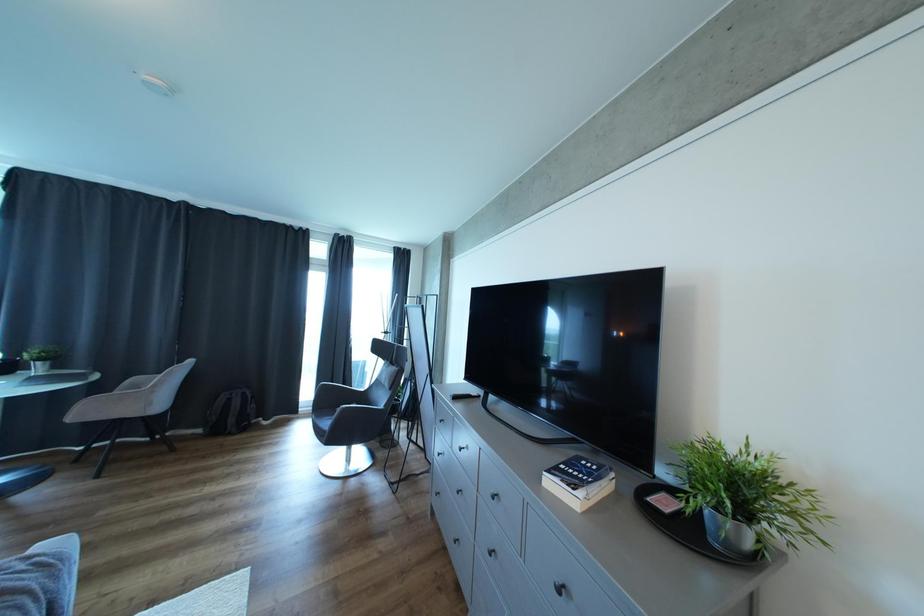
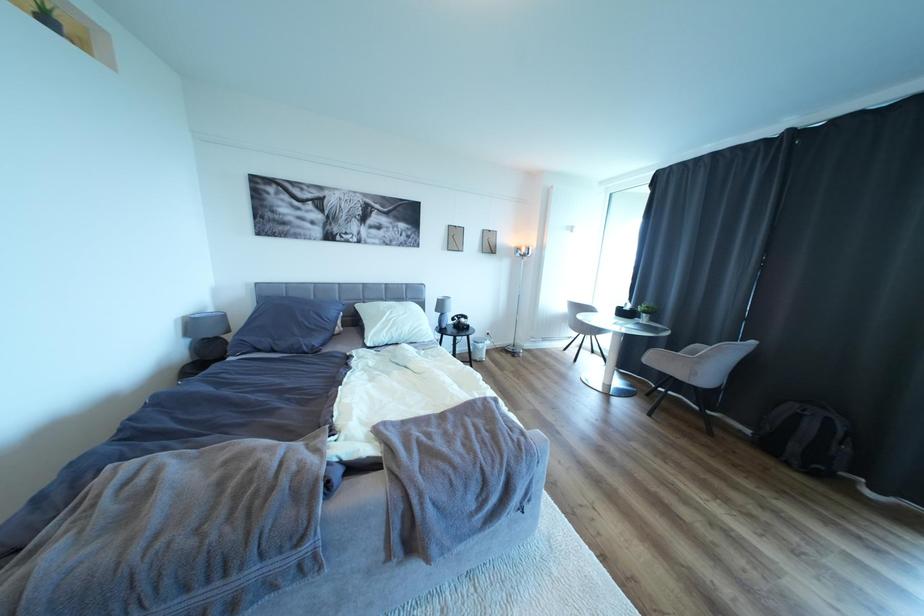
Question: The camera is either moving clockwise (left) or counter-clockwise (right) around the object. The first image is from the beginning of the video and the second image is from the end. Is the camera moving left or right when shooting the video?

Choices:
 (A) Left
 (B) Right

Answer: (B)